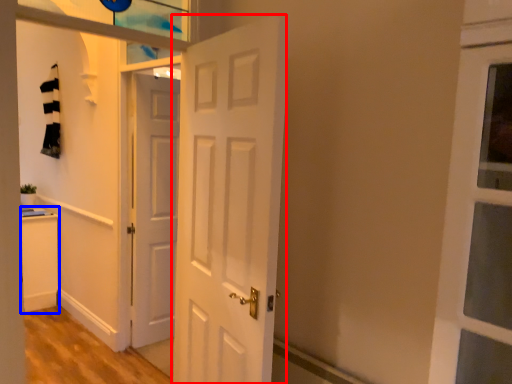
Question: Which point is closer to the camera, door (highlighted by a red box) or cabinetry (highlighted by a blue box)?

Choices:
 (A) door
 (B) cabinetry

Answer: (A)